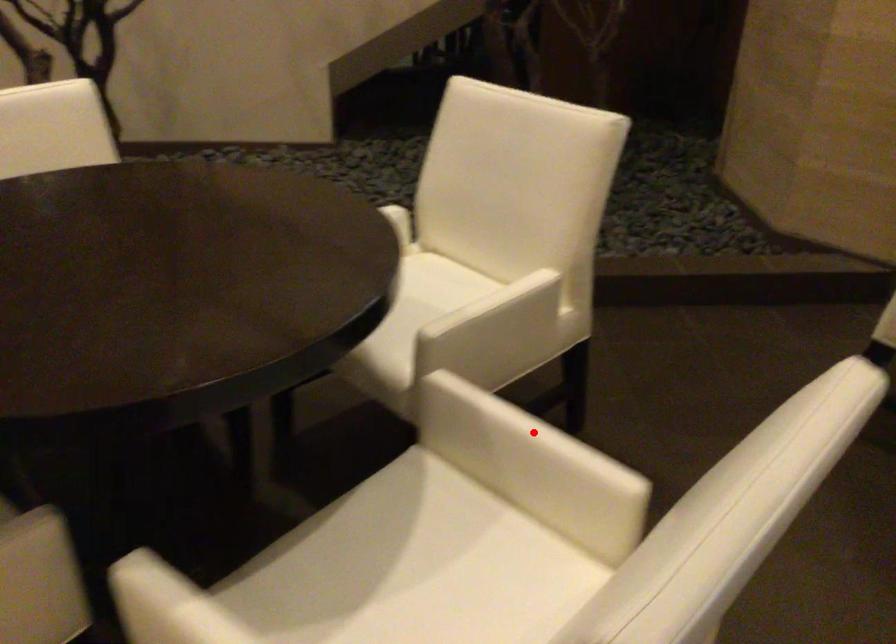
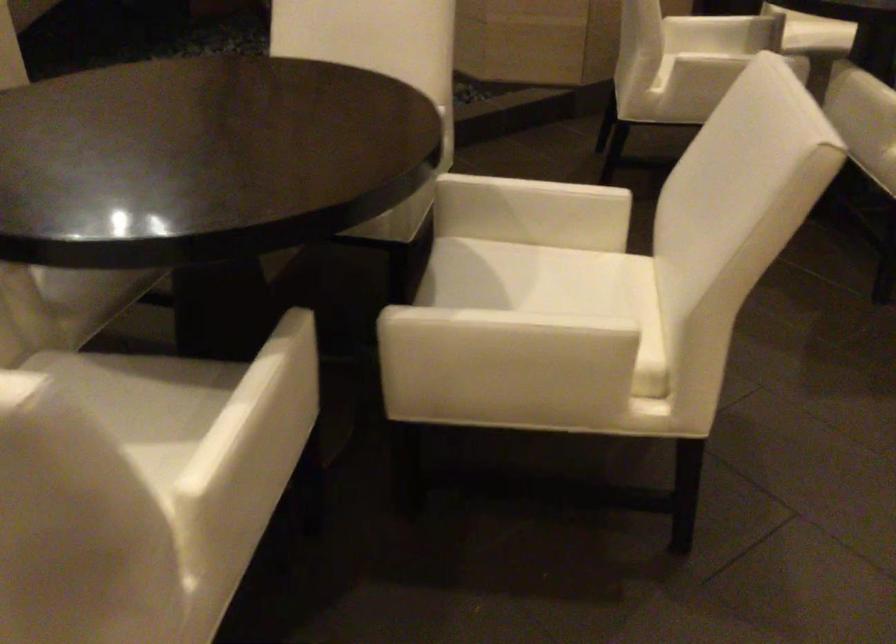
Locate, in the second image, the point that corresponds to the highlighted location in the first image.

(538, 185)